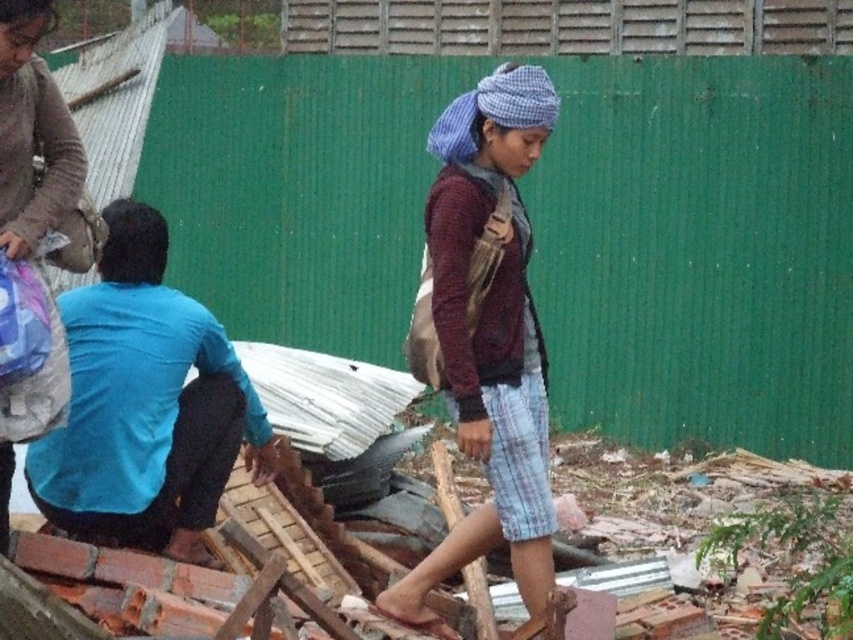
Can you confirm if blue long-sleeve shirt at left is positioned above matte gray sweater at upper left?

No, blue long-sleeve shirt at left is not above matte gray sweater at upper left.

Can you confirm if blue long-sleeve shirt at left is positioned to the left of matte gray sweater at upper left?

Incorrect, blue long-sleeve shirt at left is not on the left side of matte gray sweater at upper left.

Where is `blue long-sleeve shirt at left`? Image resolution: width=853 pixels, height=640 pixels. blue long-sleeve shirt at left is located at coordinates (144, 404).

Which of these two, maroon knitted sweater at center or matte gray sweater at upper left, stands taller?

maroon knitted sweater at center

Is maroon knitted sweater at center thinner than matte gray sweater at upper left?

No.

Locate an element on the screen. This screenshot has width=853, height=640. maroon knitted sweater at center is located at coordinates (488, 337).

Find the location of a particular element. This screenshot has width=853, height=640. maroon knitted sweater at center is located at coordinates (488, 337).

Does maroon knitted sweater at center come in front of blue long-sleeve shirt at left?

That is True.

How far apart are maroon knitted sweater at center and blue long-sleeve shirt at left?

They are 1.07 meters apart.

This screenshot has width=853, height=640. Identify the location of maroon knitted sweater at center. (488, 337).